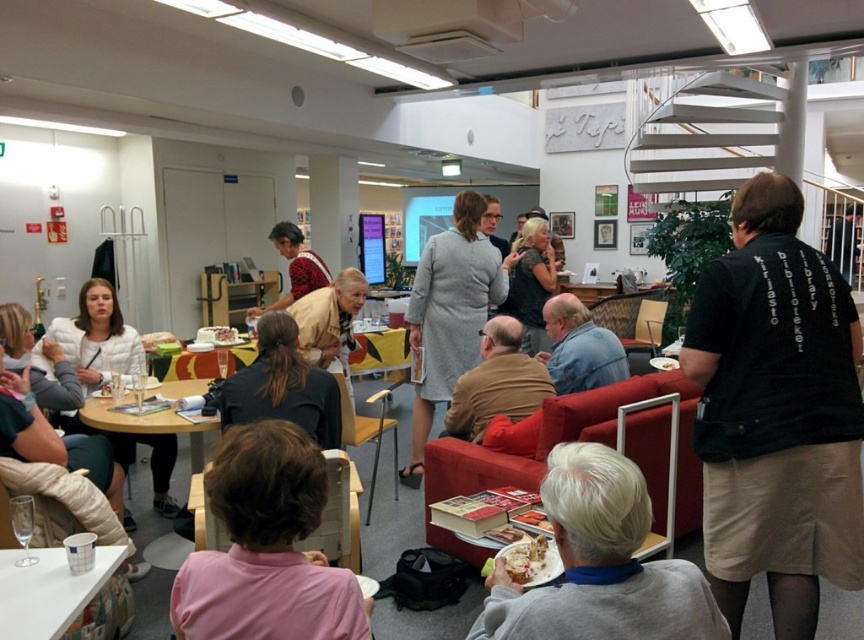
You are standing at the entrance of the room and want to go to the black fabric library at right. Which direction should you move in to reach it?

Since the black fabric library at right is located at coordinates point (776, 413), you should move towards the right side of the room to reach it.